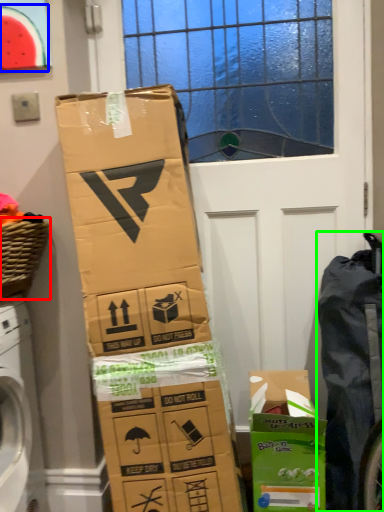
Question: Which object is the farthest from basket (highlighted by a red box)? Choose among these: watermelon (highlighted by a blue box) or waste (highlighted by a green box).

Choices:
 (A) watermelon
 (B) waste

Answer: (B)